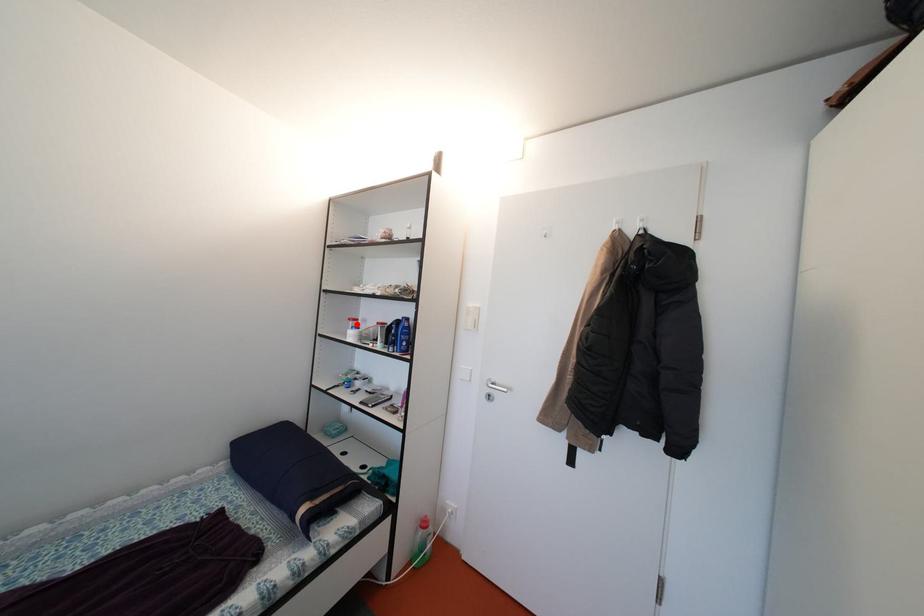
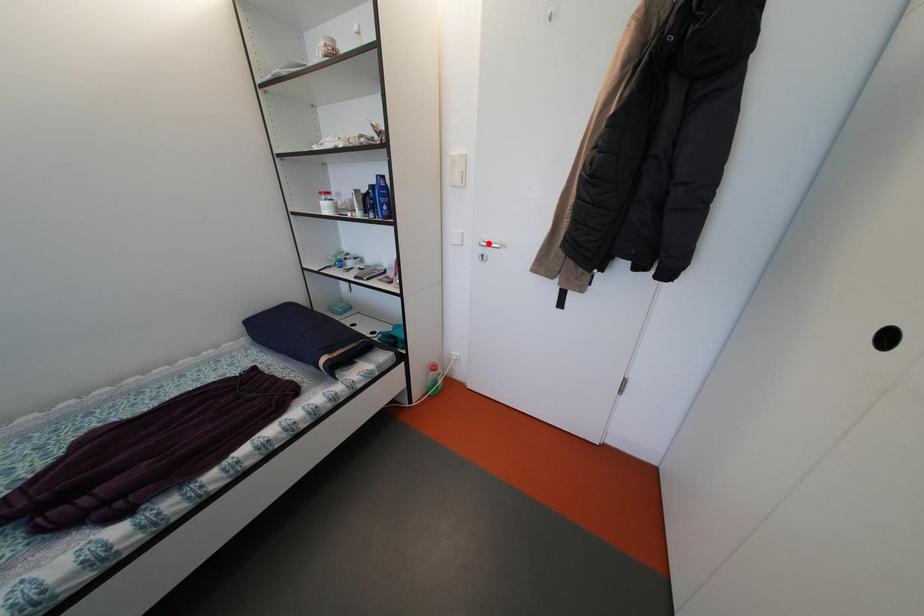
I am providing you with two images of the same scene from different viewpoints. A red point is marked on the first image and another point is marked on the second image. Does the point marked in image1 correspond to the same location as the one in image2?

No